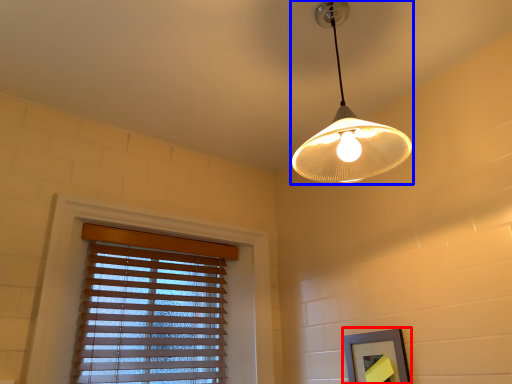
Question: Which of the following is the closest to the observer, picture frame (highlighted by a red box) or lamp (highlighted by a blue box)?

Choices:
 (A) picture frame
 (B) lamp

Answer: (B)